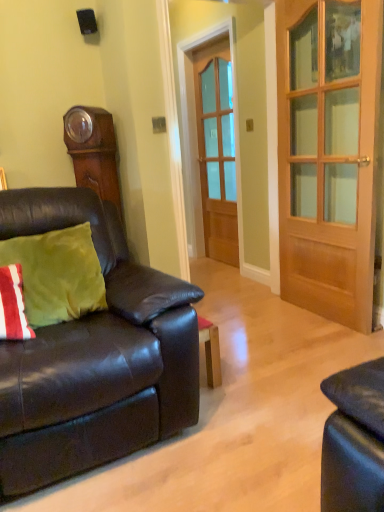
Locate an element on the screen. The height and width of the screenshot is (512, 384). free spot below wooden door at center, the 1th door viewed from the right (from a real-world perspective) is located at coordinates (316, 317).